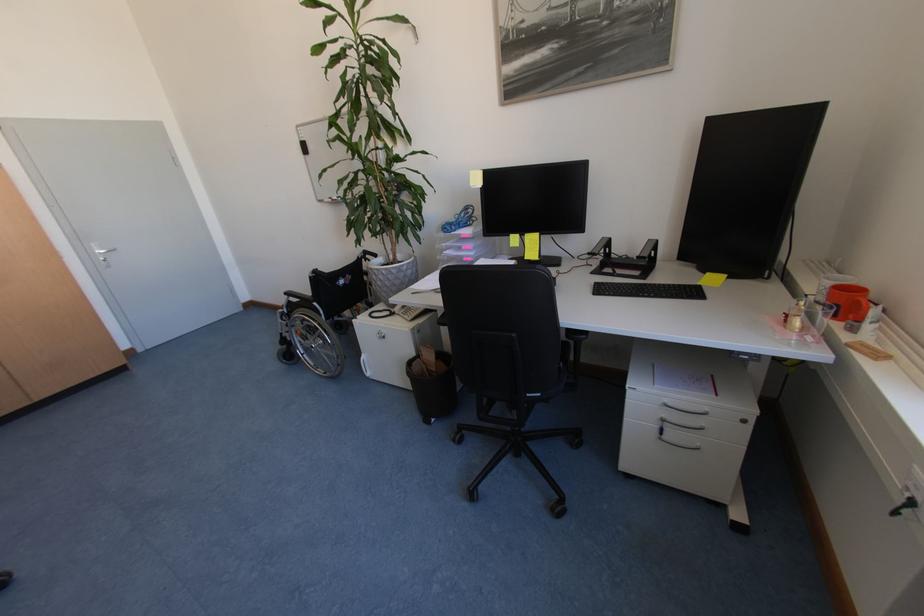
You are a GUI agent. You are given a task and a screenshot of the screen. Output one action in this format:
    pyautogui.click(x=<x>, y=<y>)
    Task: Click on the phone handset
    Image resolution: width=924 pixels, height=616 pixels.
    Given the screenshot: What is the action you would take?
    [600, 249]